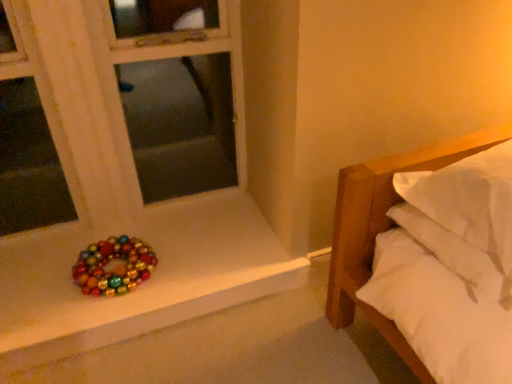
Question: Is glossy multicolored beads at lower left located outside white soft bed at right?

Choices:
 (A) no
 (B) yes

Answer: (B)

Question: Is glossy multicolored beads at lower left at the right side of white soft bed at right?

Choices:
 (A) no
 (B) yes

Answer: (A)

Question: Can you confirm if glossy multicolored beads at lower left is taller than white soft bed at right?

Choices:
 (A) no
 (B) yes

Answer: (A)

Question: Considering the relative sizes of glossy multicolored beads at lower left and white soft bed at right in the image provided, is glossy multicolored beads at lower left smaller than white soft bed at right?

Choices:
 (A) no
 (B) yes

Answer: (B)

Question: Is glossy multicolored beads at lower left oriented away from white soft bed at right?

Choices:
 (A) no
 (B) yes

Answer: (A)

Question: Is glossy multicolored beads at lower left aimed at white soft bed at right?

Choices:
 (A) no
 (B) yes

Answer: (A)

Question: Does multicolored baubles at lower left have a greater width compared to white soft bed at right?

Choices:
 (A) yes
 (B) no

Answer: (A)

Question: From the image's perspective, is multicolored baubles at lower left over white soft bed at right?

Choices:
 (A) yes
 (B) no

Answer: (B)

Question: Would you say multicolored baubles at lower left is outside white soft bed at right?

Choices:
 (A) yes
 (B) no

Answer: (A)

Question: Could white soft bed at right be considered to be inside multicolored baubles at lower left?

Choices:
 (A) yes
 (B) no

Answer: (B)

Question: Does multicolored baubles at lower left have a larger size compared to white soft bed at right?

Choices:
 (A) no
 (B) yes

Answer: (A)

Question: Can you confirm if multicolored baubles at lower left is positioned to the left of white soft bed at right?

Choices:
 (A) no
 (B) yes

Answer: (B)

Question: Is multicolored baubles at lower left at the back of white soft bed at right?

Choices:
 (A) yes
 (B) no

Answer: (B)